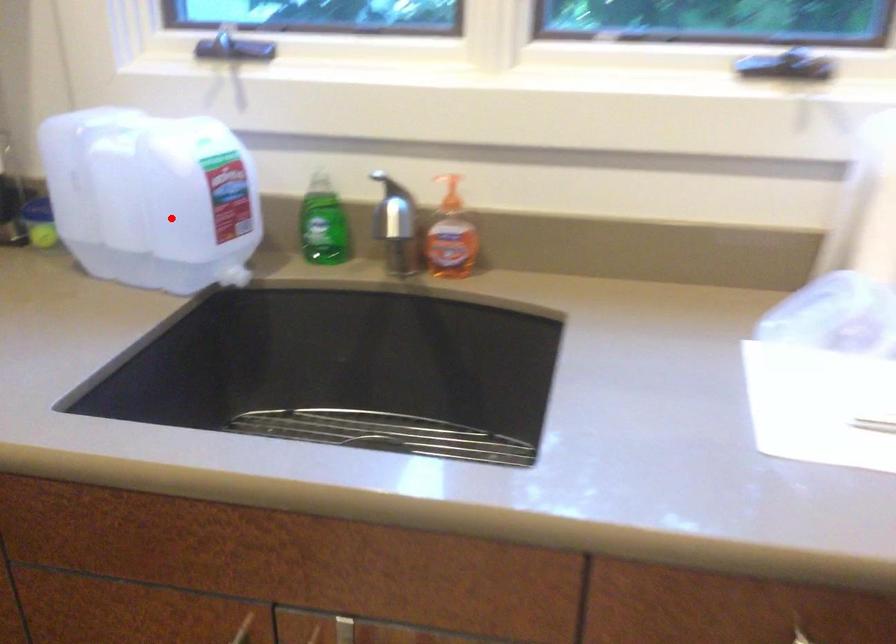
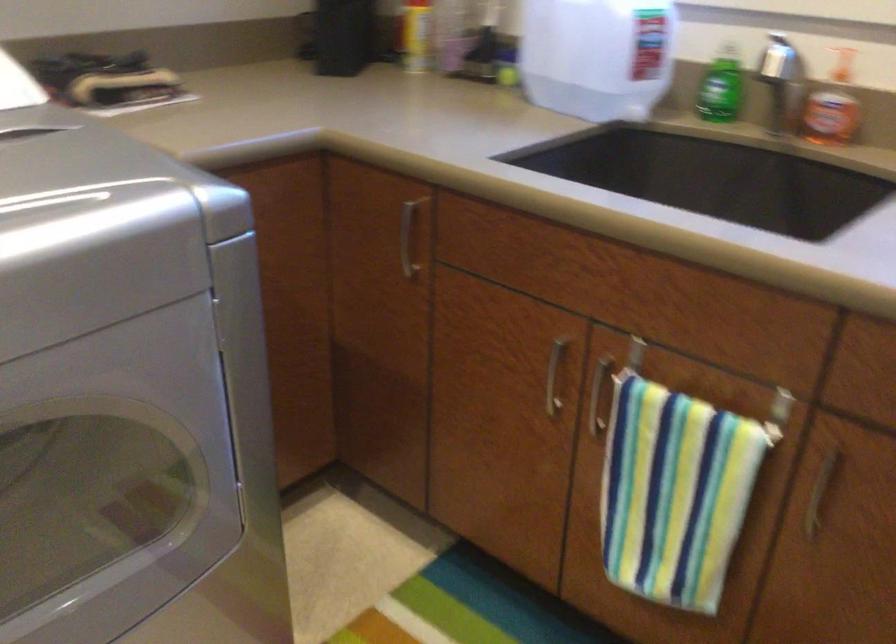
Where in the second image is the point corresponding to the highlighted location from the first image?

(597, 55)